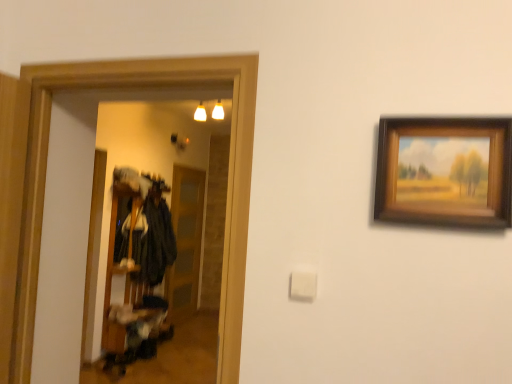
Question: Can you confirm if velvet black coat at center is smaller than wooden picture frame at upper right?

Choices:
 (A) yes
 (B) no

Answer: (B)

Question: Are velvet black coat at center and wooden picture frame at upper right far apart?

Choices:
 (A) no
 (B) yes

Answer: (B)

Question: Can we say velvet black coat at center lies outside wooden picture frame at upper right?

Choices:
 (A) no
 (B) yes

Answer: (B)

Question: Is velvet black coat at center positioned before wooden picture frame at upper right?

Choices:
 (A) no
 (B) yes

Answer: (A)

Question: From a real-world perspective, is velvet black coat at center physically above wooden picture frame at upper right?

Choices:
 (A) no
 (B) yes

Answer: (A)

Question: Is point (185, 271) positioned closer to the camera than point (509, 152)?

Choices:
 (A) closer
 (B) farther

Answer: (B)

Question: Is transparent glass door at center bigger or smaller than wooden picture frame at upper right?

Choices:
 (A) small
 (B) big

Answer: (B)

Question: From the image's perspective, is transparent glass door at center located above or below wooden picture frame at upper right?

Choices:
 (A) below
 (B) above

Answer: (A)

Question: Would you say transparent glass door at center is to the left or to the right of wooden picture frame at upper right in the picture?

Choices:
 (A) right
 (B) left

Answer: (B)

Question: Considering their positions, is wooden picture frame at upper right located in front of or behind velvet black coat at center?

Choices:
 (A) behind
 (B) front

Answer: (B)

Question: Is wooden picture frame at upper right wider or thinner than velvet black coat at center?

Choices:
 (A) thin
 (B) wide

Answer: (A)

Question: From the image's perspective, is wooden picture frame at upper right positioned above or below velvet black coat at center?

Choices:
 (A) above
 (B) below

Answer: (A)

Question: Visually, is wooden picture frame at upper right positioned to the left or to the right of velvet black coat at center?

Choices:
 (A) left
 (B) right

Answer: (B)

Question: Is point (179, 241) closer or farther from the camera than point (116, 236)?

Choices:
 (A) farther
 (B) closer

Answer: (A)

Question: From the image's perspective, is transparent glass door at center above or below velvet black coat at center?

Choices:
 (A) above
 (B) below

Answer: (B)